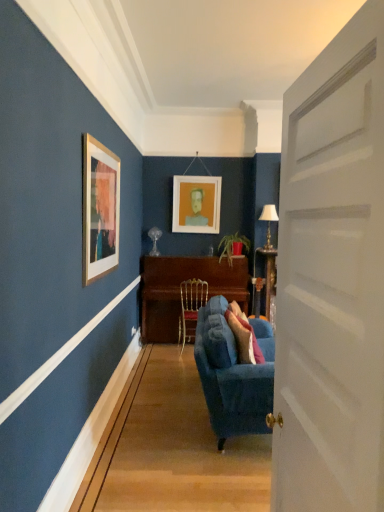
Question: From the image's perspective, is gold metallic chair at center positioned above or below white matte picture frame at center?

Choices:
 (A) above
 (B) below

Answer: (B)

Question: Is gold metallic chair at center wider or thinner than white matte picture frame at center?

Choices:
 (A) thin
 (B) wide

Answer: (B)

Question: Considering the real-world distances, which object is closest to the wooden piano at center?

Choices:
 (A) white matte door at center
 (B) white fabric lampshade at right
 (C) gold metallic chair at center
 (D) white matte picture frame at center
 (E) velvet blue couch at center

Answer: (C)

Question: Which object is positioned farthest from the wooden piano at center?

Choices:
 (A) white matte picture frame at center
 (B) velvet blue couch at center
 (C) gold metallic chair at center
 (D) white matte door at center
 (E) white fabric lampshade at right

Answer: (D)